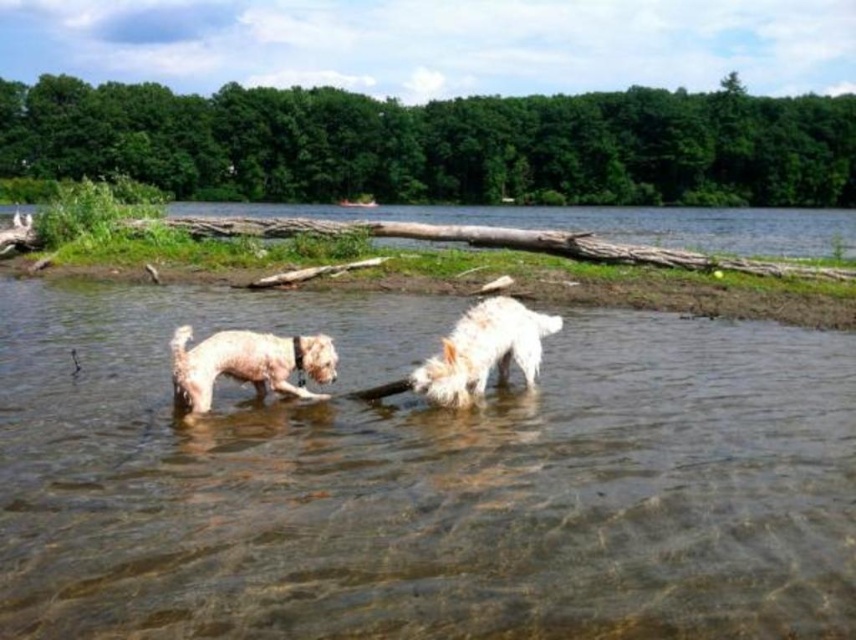
Does clear water at center have a lesser height compared to white fluffy dog at lower left?

Incorrect, clear water at center's height does not fall short of white fluffy dog at lower left's.

Is point (535, 422) positioned before point (224, 364)?

No, (535, 422) is further to viewer.

Between point (403, 515) and point (181, 362), which one is positioned behind?

Point (181, 362)

Locate an element on the screen. This screenshot has height=640, width=856. clear water at center is located at coordinates (421, 480).

I want to click on brown rough log at upper center, so click(562, 230).

Can you confirm if brown rough log at upper center is positioned to the right of white fluffy dog at center?

Yes, brown rough log at upper center is to the right of white fluffy dog at center.

Measure the distance between brown rough log at upper center and camera.

The distance of brown rough log at upper center from camera is 51.92 feet.

At what (x,y) coordinates should I click in order to perform the action: click on brown rough log at upper center. Please return your answer as a coordinate pair (x, y). This screenshot has height=640, width=856. Looking at the image, I should click on (562, 230).

Who is taller, clear water at center or white fluffy dog at center?

Standing taller between the two is clear water at center.

Is clear water at center to the left of white fluffy dog at center from the viewer's perspective?

Correct, you'll find clear water at center to the left of white fluffy dog at center.

Which is behind, point (533, 568) or point (473, 385)?

Point (473, 385)

Locate an element on the screen. clear water at center is located at coordinates (421, 480).